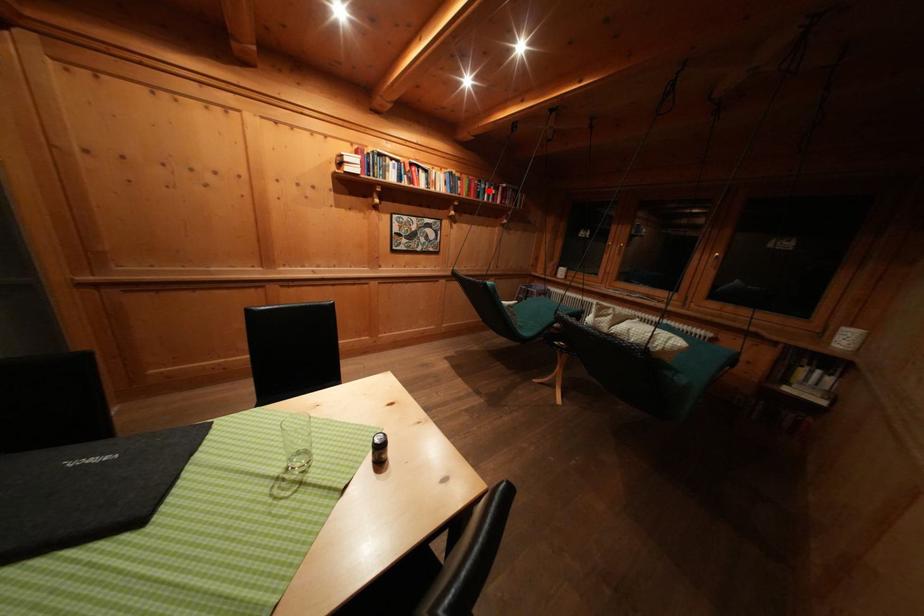
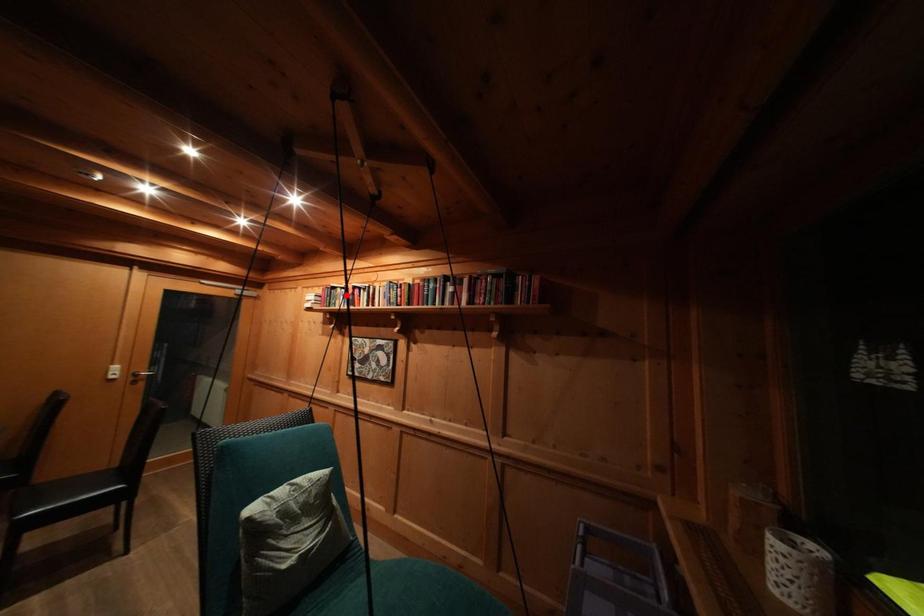
I am providing you with two images of the same scene from different viewpoints. A red point is marked on the first image and another point is marked on the second image. Are the points marked in image1 and image2 representing the same 3D position?

No